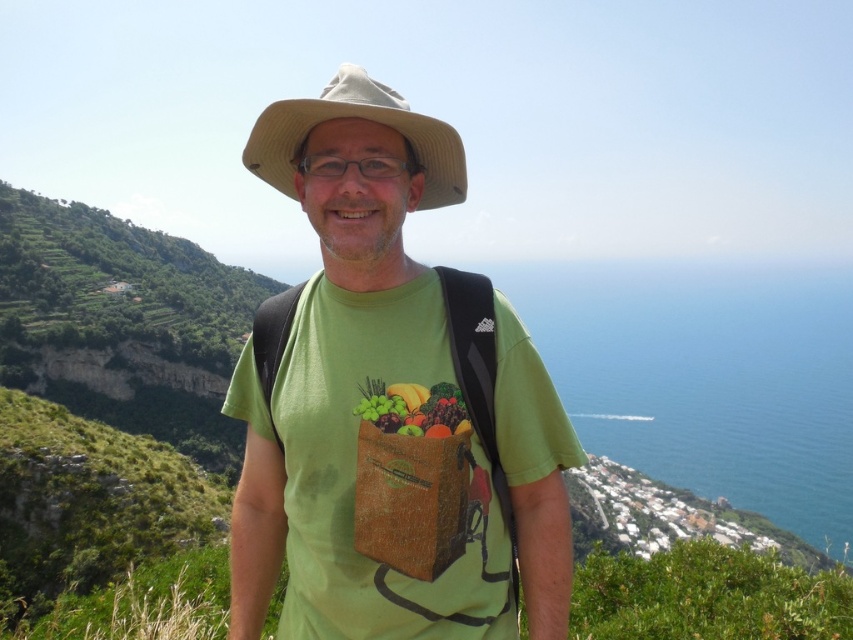
Who is taller, green fabric t-shirt at center or glossy plastic bag of fruits at center?

With more height is green fabric t-shirt at center.

Does green fabric t-shirt at center appear on the left side of glossy plastic bag of fruits at center?

Correct, you'll find green fabric t-shirt at center to the left of glossy plastic bag of fruits at center.

Does point (531, 438) come closer to viewer compared to point (387, 401)?

That is False.

You are a GUI agent. You are given a task and a screenshot of the screen. Output one action in this format:
    pyautogui.click(x=<x>, y=<y>)
    Task: Click on the green fabric t-shirt at center
    This screenshot has width=853, height=640.
    Given the screenshot: What is the action you would take?
    pyautogui.click(x=361, y=396)

Can you confirm if green fabric t-shirt at center is positioned above beige fabric cowboy hat at center?

No, green fabric t-shirt at center is not above beige fabric cowboy hat at center.

Can you confirm if green fabric t-shirt at center is smaller than beige fabric cowboy hat at center?

No, green fabric t-shirt at center is not smaller than beige fabric cowboy hat at center.

Which is behind, point (248, 371) or point (440, 140)?

Positioned behind is point (248, 371).

The width and height of the screenshot is (853, 640). I want to click on green fabric t-shirt at center, so click(361, 396).

Is point (434, 204) farther from viewer compared to point (434, 390)?

Yes, it is behind point (434, 390).

Does point (263, 172) lie in front of point (370, 392)?

That is False.

Is point (415, 148) positioned behind point (381, 422)?

That is True.

Locate an element on the screen. This screenshot has height=640, width=853. beige fabric cowboy hat at center is located at coordinates (x=358, y=116).